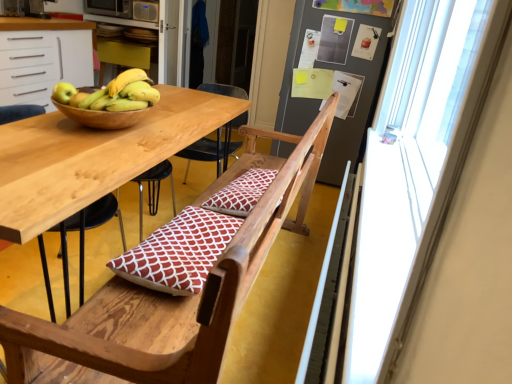
Identify the location of green matte apple at upper left. (63, 92).

Image resolution: width=512 pixels, height=384 pixels. What do you see at coordinates (113, 94) in the screenshot? I see `yellow matte bananas at upper left` at bounding box center [113, 94].

The height and width of the screenshot is (384, 512). What are the coordinates of `transparent plastic screen door at upper center` in the screenshot? It's located at (234, 42).

Looking at the image, does yellow matte bananas at upper left seem bigger or smaller compared to transparent plastic screen door at upper center?

Clearly, yellow matte bananas at upper left is smaller in size than transparent plastic screen door at upper center.

Is point (70, 96) positioned behind point (223, 18)?

No, (70, 96) is in front of (223, 18).

Based on their positions, is yellow matte bananas at upper left located to the left or right of transparent plastic screen door at upper center?

yellow matte bananas at upper left is to the left of transparent plastic screen door at upper center.

Locate an element on the screen. This screenshot has height=384, width=512. quilt lying in front of the matte white cabinet at upper left is located at coordinates (179, 252).

In the scene shown: Considering the sizes of matte white cabinet at upper left and red printed cushion at center in the image, is matte white cabinet at upper left bigger or smaller than red printed cushion at center?

matte white cabinet at upper left is bigger than red printed cushion at center.

Are matte white cabinet at upper left and red printed cushion at center far apart?

matte white cabinet at upper left is positioned a significant distance from red printed cushion at center.

Considering the sizes of objects transparent glass window at right and metallic microwave at upper left in the image provided, who is wider, transparent glass window at right or metallic microwave at upper left?

transparent glass window at right is wider.

Consider the image. Which object is positioned more to the left, transparent glass window at right or metallic microwave at upper left?

From the viewer's perspective, metallic microwave at upper left appears more on the left side.

Locate an element on the screen. appliance above the transparent glass window at right (from a real-world perspective) is located at coordinates (146, 11).

Is transparent glass window at right turned away from metallic microwave at upper left?

No, transparent glass window at right's orientation is not away from metallic microwave at upper left.

From their relative heights in the image, would you say transparent glass window at right is taller or shorter than matte white cabinet at upper left?

Clearly, transparent glass window at right is shorter compared to matte white cabinet at upper left.

Which is farther from the camera, (451, 153) or (13, 28)?

The point (13, 28) is farther from the camera.

The image size is (512, 384). What are the coordinates of `cabinetry that appears above the transparent glass window at right (from the image's perspective)` in the screenshot? It's located at (42, 58).

From a real-world perspective, between red printed cushion at center and white patterned cushion at center, who is vertically higher?

white patterned cushion at center, from a real-world perspective.

Is white patterned cushion at center located within red printed cushion at center?

Definitely not — white patterned cushion at center is not inside red printed cushion at center.

In terms of size, does red printed cushion at center appear bigger or smaller than white patterned cushion at center?

Considering their sizes, red printed cushion at center takes up more space than white patterned cushion at center.

In the scene shown: From a real-world perspective, is white patterned cushion at center above or below transparent plastic screen door at upper center?

white patterned cushion at center is situated lower than transparent plastic screen door at upper center in the real world.

Looking at this image, is white patterned cushion at center turned away from transparent plastic screen door at upper center?

No.

From the image's perspective, which is above, white patterned cushion at center or transparent plastic screen door at upper center?

transparent plastic screen door at upper center.

Would you say white patterned cushion at center is a long distance from transparent plastic screen door at upper center?

Yes, white patterned cushion at center and transparent plastic screen door at upper center are located far from each other.

From the image's perspective, is white patterned cushion at center on top of transparent glass window at right?

Actually, white patterned cushion at center appears below transparent glass window at right in the image.

Is transparent glass window at right inside white patterned cushion at center?

No, transparent glass window at right is not a part of white patterned cushion at center.

In the scene shown: Measure the distance from white patterned cushion at center to transparent glass window at right.

A distance of 24.82 inches exists between white patterned cushion at center and transparent glass window at right.

Is white patterned cushion at center oriented towards transparent glass window at right?

No, white patterned cushion at center does not turn towards transparent glass window at right.

Image resolution: width=512 pixels, height=384 pixels. In order to click on banana lying below the transparent plastic screen door at upper center (from the image's perspective) in this screenshot , I will do point(113,94).

Identify the location of quilt in front of the matte white cabinet at upper left. (179, 252).

Based on their spatial positions, is transparent plastic screen door at upper center or yellow matte bananas at upper left closer to white patterned cushion at center?

yellow matte bananas at upper left lies closer to white patterned cushion at center than the other object.

Looking at the image, which one is located further to white patterned cushion at center, metallic microwave at upper left or transparent plastic screen door at upper center?

Among the two, transparent plastic screen door at upper center is located further to white patterned cushion at center.

Looking at the image, which one is located further to yellow matte bananas at upper left, wooden chair at center or red printed cushion at center?

wooden chair at center is further to yellow matte bananas at upper left.

Based on their spatial positions, is yellow matte bananas at upper left or metallic microwave at upper left closer to matte white cabinet at upper left?

The object closer to matte white cabinet at upper left is metallic microwave at upper left.

Estimate the real-world distances between objects in this image. Which object is further from green matte apple at upper left, metallic microwave at upper left or matte white cabinet at upper left?

Among the two, metallic microwave at upper left is located further to green matte apple at upper left.

Based on their spatial positions, is metallic microwave at upper left or yellow matte bananas at upper left further from white patterned cushion at center?

metallic microwave at upper left lies further to white patterned cushion at center than the other object.

Looking at the image, which one is located closer to green matte apple at upper left, white patterned cushion at center or transparent glass window at right?

The object closer to green matte apple at upper left is white patterned cushion at center.

Looking at the image, which one is located closer to green matte apple at upper left, metallic microwave at upper left or red printed cushion at center?

Among the two, red printed cushion at center is located nearer to green matte apple at upper left.

Identify the location of apple between wooden chair at center and metallic microwave at upper left in the front-back direction. This screenshot has width=512, height=384. (63, 92).

You are a GUI agent. You are given a task and a screenshot of the screen. Output one action in this format:
    pyautogui.click(x=<x>, y=<y>)
    Task: Click on the banana positioned between wooden chair at center and matte white cabinet at upper left from near to far
    The width and height of the screenshot is (512, 384).
    Given the screenshot: What is the action you would take?
    pyautogui.click(x=113, y=94)

This screenshot has height=384, width=512. Find the location of `quilt located between wooden chair at center and green matte apple at upper left in the depth direction`. quilt located between wooden chair at center and green matte apple at upper left in the depth direction is located at coordinates (179, 252).

I want to click on cabinetry between green matte apple at upper left and metallic microwave at upper left in the front-back direction, so click(x=42, y=58).